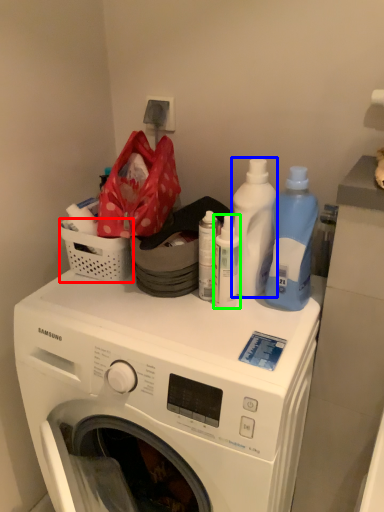
Question: Considering the real-world distances, which object is closest to basket (highlighted by a red box)? cleaning product (highlighted by a blue box) or cleaning product (highlighted by a green box).

Choices:
 (A) cleaning product
 (B) cleaning product

Answer: (B)